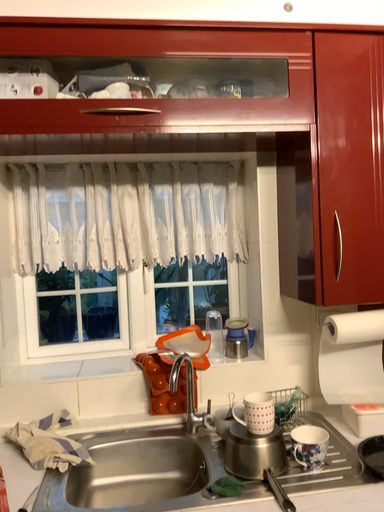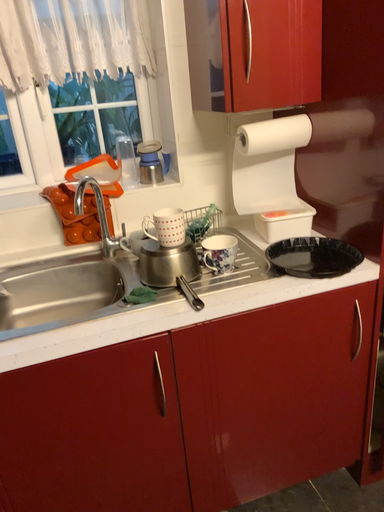
Question: How did the camera likely rotate when shooting the video?

Choices:
 (A) rotated downward
 (B) rotated upward

Answer: (A)